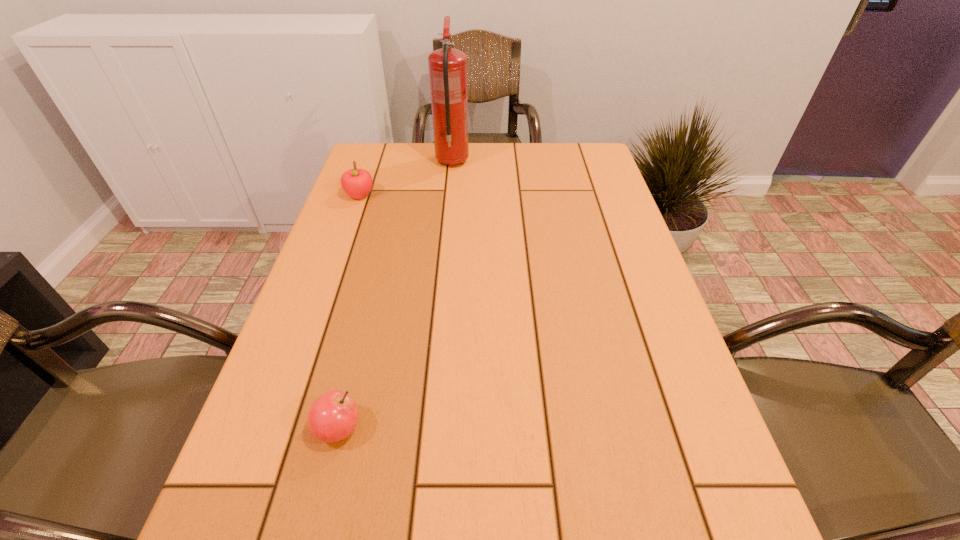
This screenshot has height=540, width=960. What are the coordinates of `vacant region at the far edge of the desktop` in the screenshot? It's located at (520, 160).

The height and width of the screenshot is (540, 960). Find the location of `free space at the left edge`. free space at the left edge is located at coordinates (323, 362).

In the image, there is a desktop. Where is `vacant space at the right edge`? vacant space at the right edge is located at coordinates (624, 423).

You are a GUI agent. You are given a task and a screenshot of the screen. Output one action in this format:
    pyautogui.click(x=<x>, y=<y>)
    Task: Click on the free location at the far left corner
    The width and height of the screenshot is (960, 540).
    Given the screenshot: What is the action you would take?
    pyautogui.click(x=379, y=143)

Identify the location of vacant space in between the fire extinguisher and the shortest object. (396, 295).

The image size is (960, 540). Find the location of `vacant point located between the right apple and the rightmost object`. vacant point located between the right apple and the rightmost object is located at coordinates (396, 295).

Where is `free space between the tallest object and the second tallest object`? This screenshot has height=540, width=960. free space between the tallest object and the second tallest object is located at coordinates (406, 179).

Where is `unoccupied area between the fire extinguisher and the left apple`? This screenshot has height=540, width=960. unoccupied area between the fire extinguisher and the left apple is located at coordinates (406, 179).

Identify the location of empty space that is in between the second farthest object and the nearest object. This screenshot has width=960, height=540. (349, 312).

Locate an element on the screen. free space between the tallest object and the second object from right to left is located at coordinates (396, 295).